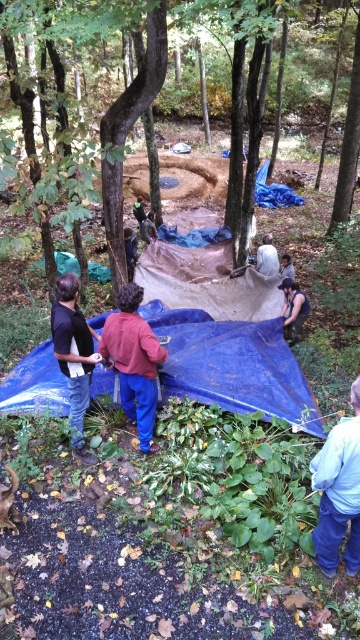
Question: Is blue tarp at center thinner than dark brown leather jacket at center?

Choices:
 (A) yes
 (B) no

Answer: (B)

Question: Is brown rough tarp at center above blue denim jeans at lower right?

Choices:
 (A) no
 (B) yes

Answer: (B)

Question: Which point is closer to the camera?

Choices:
 (A) dark brown leather jacket at center
 (B) brown leather jacket at lower right

Answer: (A)

Question: Can you confirm if brown rough tarp at center is positioned to the left of blue denim jeans at lower right?

Choices:
 (A) yes
 (B) no

Answer: (A)

Question: Which object appears closest to the camera in this image?

Choices:
 (A) dark brown leather jacket at center
 (B) brown leather jacket at lower right
 (C) black matte shirt at center
 (D) smooth bark tree at center

Answer: (C)

Question: Which of the following is the closest to the observer?

Choices:
 (A) click(354, 51)
 (B) click(82, 406)
 (C) click(204, 314)

Answer: (B)